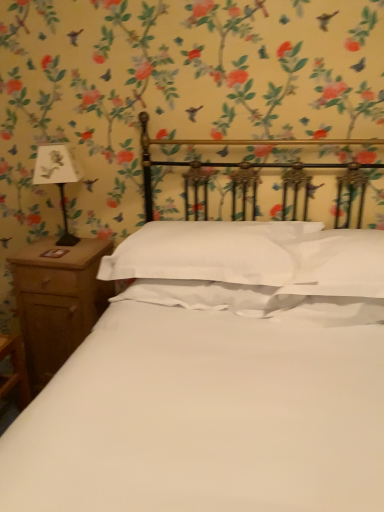
Question: Would you say white smooth pillow at center is to the left or to the right of white paper at left in the picture?

Choices:
 (A) left
 (B) right

Answer: (B)

Question: From a real-world perspective, is white smooth pillow at center positioned above or below white paper at left?

Choices:
 (A) above
 (B) below

Answer: (B)

Question: Considering the real-world distances, which object is farthest from the brown wood nightstand at left?

Choices:
 (A) white smooth pillow at center
 (B) white paper at left

Answer: (A)

Question: Which of these objects is positioned closest to the white smooth pillow at center?

Choices:
 (A) brown wood nightstand at left
 (B) white paper at left

Answer: (A)